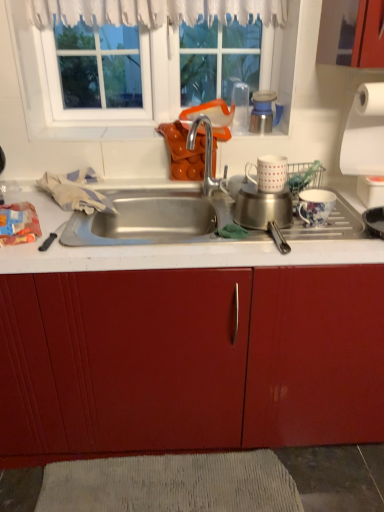
Question: From the image's perspective, is white glass window at upper center located beneath white textured mat at lower center?

Choices:
 (A) yes
 (B) no

Answer: (B)

Question: Is white glass window at upper center located outside white textured mat at lower center?

Choices:
 (A) no
 (B) yes

Answer: (B)

Question: Would you say white glass window at upper center contains white textured mat at lower center?

Choices:
 (A) no
 (B) yes

Answer: (A)

Question: Does white glass window at upper center appear on the right side of white textured mat at lower center?

Choices:
 (A) no
 (B) yes

Answer: (A)

Question: Is white glass window at upper center looking in the opposite direction of white textured mat at lower center?

Choices:
 (A) yes
 (B) no

Answer: (B)

Question: From the image's perspective, is floral porcelain mug at right, the 1th coffee cup in the right-to-left sequence, located above or below white glass window at upper center?

Choices:
 (A) below
 (B) above

Answer: (A)

Question: Which is correct: floral porcelain mug at right, positioned as the 2th coffee cup in left-to-right order, is inside white glass window at upper center, or outside of it?

Choices:
 (A) outside
 (B) inside

Answer: (A)

Question: In the image, is floral porcelain mug at right, the second coffee cup positioned from the top, positioned in front of or behind white glass window at upper center?

Choices:
 (A) behind
 (B) front

Answer: (B)

Question: Is point (314, 221) positioned closer to the camera than point (153, 101)?

Choices:
 (A) closer
 (B) farther

Answer: (A)

Question: Is silver metallic faucet at center inside or outside of white matte coffee cup at upper center, the 1th coffee cup viewed from the left?

Choices:
 (A) outside
 (B) inside

Answer: (A)

Question: Looking at the image, does silver metallic faucet at center seem bigger or smaller compared to white matte coffee cup at upper center, arranged as the 2th coffee cup when ordered from the bottom?

Choices:
 (A) small
 (B) big

Answer: (B)

Question: Is silver metallic faucet at center in front of or behind white matte coffee cup at upper center, arranged as the 2th coffee cup when ordered from the bottom, in the image?

Choices:
 (A) front
 (B) behind

Answer: (B)

Question: Considering the positions of silver metallic faucet at center and white matte coffee cup at upper center, the 1th coffee cup viewed from the left, in the image, is silver metallic faucet at center wider or thinner than white matte coffee cup at upper center, the 1th coffee cup viewed from the left,?

Choices:
 (A) thin
 (B) wide

Answer: (B)

Question: In the image, is brushed metal cup at upper center positioned in front of or behind white textured mat at lower center?

Choices:
 (A) behind
 (B) front

Answer: (A)

Question: Considering the positions of brushed metal cup at upper center and white textured mat at lower center in the image, is brushed metal cup at upper center taller or shorter than white textured mat at lower center?

Choices:
 (A) tall
 (B) short

Answer: (A)